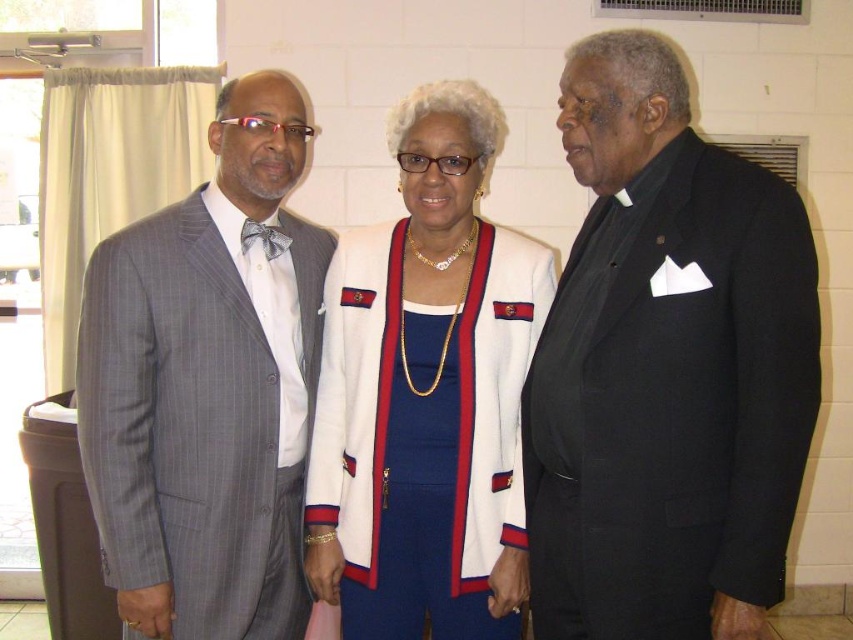
Question: Is gray pinstripe suit at left below white textured blazer at center?

Choices:
 (A) no
 (B) yes

Answer: (A)

Question: Can you confirm if gray pinstripe suit at left is positioned to the right of white textured blazer at center?

Choices:
 (A) no
 (B) yes

Answer: (A)

Question: Which object is farther from the camera taking this photo?

Choices:
 (A) gray pinstripe suit at left
 (B) black satin suit at right

Answer: (A)

Question: Estimate the real-world distances between objects in this image. Which object is closer to the black satin suit at right?

Choices:
 (A) gray pinstripe suit at left
 (B) white textured blazer at center

Answer: (B)

Question: Is black satin suit at right positioned at the back of gray pinstripe suit at left?

Choices:
 (A) no
 (B) yes

Answer: (A)

Question: Which point is farther to the camera?

Choices:
 (A) gray pinstripe suit at left
 (B) black satin suit at right
 (C) white textured blazer at center

Answer: (C)